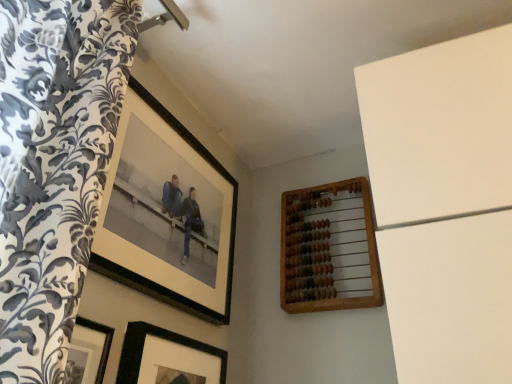
Question: Which direction should I rotate to look at black matte picture frame at lower center, acting as the second picture frame starting from the left, — up or down?

Choices:
 (A) down
 (B) up

Answer: (A)

Question: Is black matte picture frame at upper left, which is the first picture frame in left-to-right order, taller than wooden abacus at upper right, which is counted as the 1th picture frame, starting from the right?

Choices:
 (A) no
 (B) yes

Answer: (B)

Question: Is black matte picture frame at upper left, which is the first picture frame in left-to-right order, positioned before wooden abacus at upper right, arranged as the 3th picture frame when viewed from the left?

Choices:
 (A) no
 (B) yes

Answer: (B)

Question: Does black matte picture frame at upper left, which is the first picture frame in left-to-right order, appear on the left side of wooden abacus at upper right, which is counted as the 1th picture frame, starting from the right?

Choices:
 (A) yes
 (B) no

Answer: (A)

Question: Is black matte picture frame at upper left, which is the first picture frame in left-to-right order, turned away from wooden abacus at upper right, which is counted as the 1th picture frame, starting from the right?

Choices:
 (A) no
 (B) yes

Answer: (A)

Question: Is black matte picture frame at upper left, which is the first picture frame in left-to-right order, positioned behind wooden abacus at upper right, arranged as the 3th picture frame when viewed from the left?

Choices:
 (A) yes
 (B) no

Answer: (B)

Question: Is wooden abacus at upper right, arranged as the 3th picture frame when viewed from the left, located within black matte picture frame at upper left, which is the first picture frame in left-to-right order?

Choices:
 (A) no
 (B) yes

Answer: (A)

Question: Is black matte picture frame at lower center, which is counted as the second picture frame, starting from the right, aimed at wooden abacus at upper right, arranged as the 3th picture frame when viewed from the left?

Choices:
 (A) no
 (B) yes

Answer: (A)

Question: From the image's perspective, does black matte picture frame at lower center, acting as the second picture frame starting from the left, appear lower than wooden abacus at upper right, which is counted as the 1th picture frame, starting from the right?

Choices:
 (A) no
 (B) yes

Answer: (B)

Question: Can you confirm if black matte picture frame at lower center, which is counted as the second picture frame, starting from the right, is positioned to the left of wooden abacus at upper right, arranged as the 3th picture frame when viewed from the left?

Choices:
 (A) yes
 (B) no

Answer: (A)

Question: Does black matte picture frame at lower center, acting as the second picture frame starting from the left, have a lesser height compared to wooden abacus at upper right, which is counted as the 1th picture frame, starting from the right?

Choices:
 (A) no
 (B) yes

Answer: (A)

Question: Is black matte picture frame at lower center, acting as the second picture frame starting from the left, outside wooden abacus at upper right, which is counted as the 1th picture frame, starting from the right?

Choices:
 (A) no
 (B) yes

Answer: (B)

Question: Does black matte picture frame at lower center, which is counted as the second picture frame, starting from the right, have a larger size compared to wooden abacus at upper right, which is counted as the 1th picture frame, starting from the right?

Choices:
 (A) no
 (B) yes

Answer: (A)

Question: Is black matte picture frame at lower center, which is counted as the second picture frame, starting from the right, closer to camera compared to black matte picture frame at upper left, which is the first picture frame in left-to-right order?

Choices:
 (A) yes
 (B) no

Answer: (A)